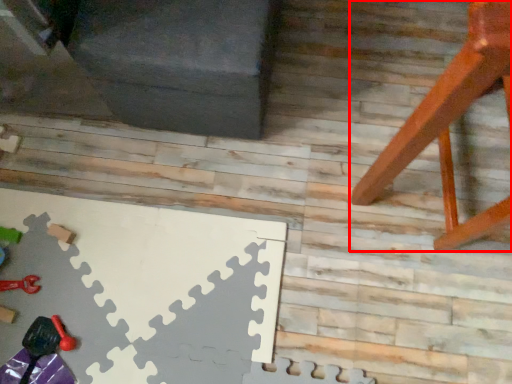
Question: From the image's perspective, what is the correct spatial positioning of furniture (annotated by the red box) in reference to toy?

Choices:
 (A) below
 (B) above

Answer: (B)